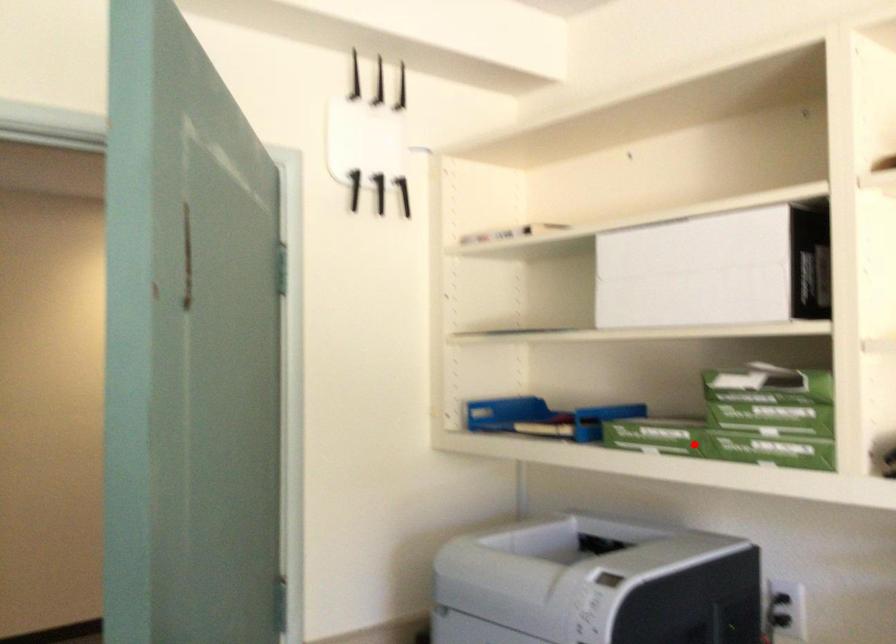
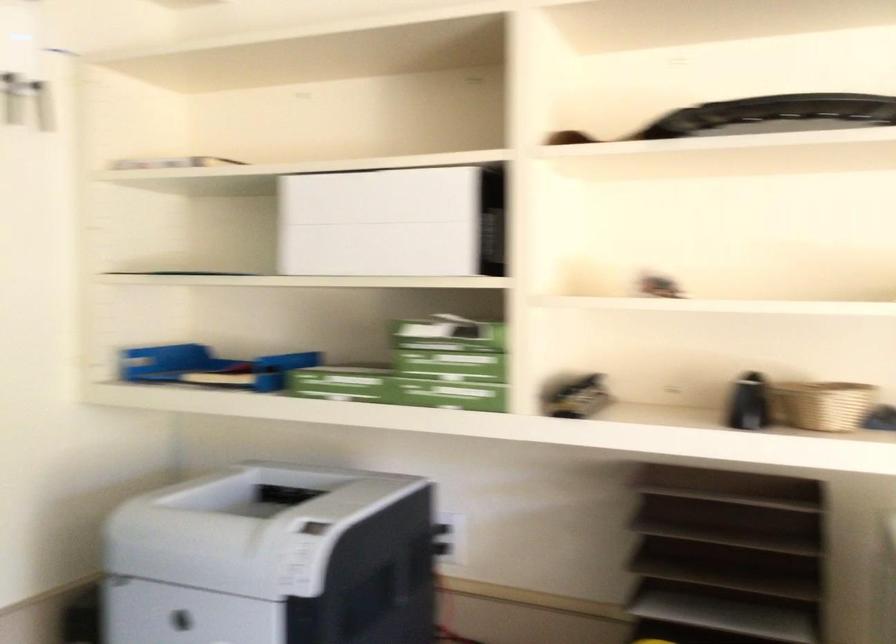
Locate, in the second image, the point that corresponds to the highlighted location in the first image.

(382, 386)